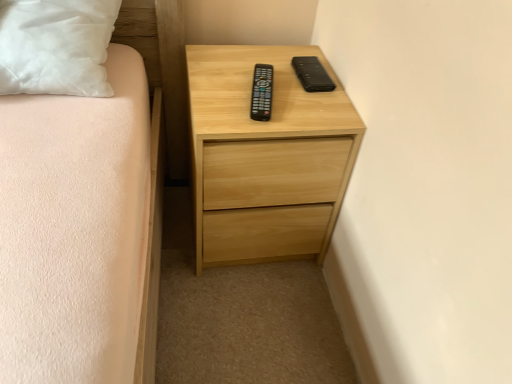
The width and height of the screenshot is (512, 384). Find the location of `free space between black plastic remote at center and black matte case at upper right`. free space between black plastic remote at center and black matte case at upper right is located at coordinates (292, 97).